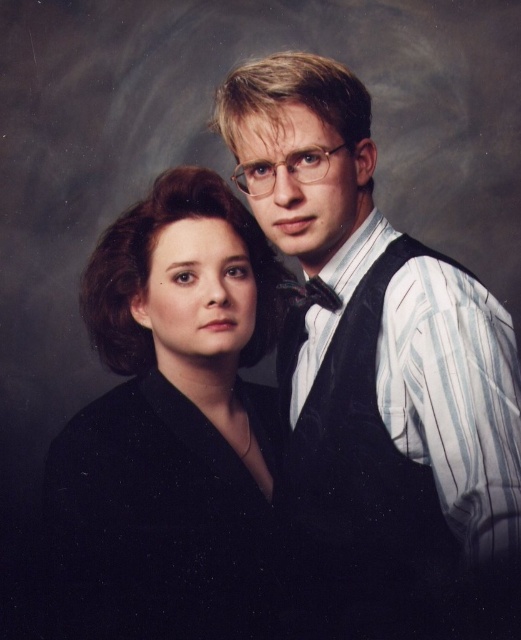
You are a photographer adjusting the lighting in the studio. You notice two black items at the center of the image. What is the relationship between the width of the black fabric at center and the shiny black bow tie at center?

The black fabric at center is wider than the shiny black bow tie at center.

You are an interior designer assessing the color contrast between the matte black vest at right and the black fabric at center in the portrait. Since both are black, how might their textures contribute to visual distinction?

The matte black vest at right has a width surpassing the black fabric at center, so its larger size and possibly different texture could create visual contrast despite both being black.

In the formal portrait, where exactly is the black fabric at center located in terms of coordinates?

The black fabric at center is located at point (170, 428).